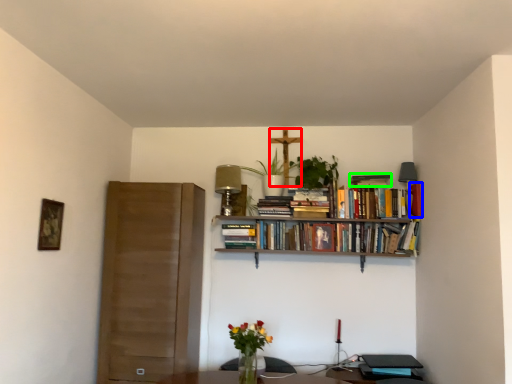
Question: Based on their relative distances, which object is nearer to crucifix (highlighted by a red box)? Choose from book (highlighted by a blue box) and book (highlighted by a green box).

Choices:
 (A) book
 (B) book

Answer: (B)